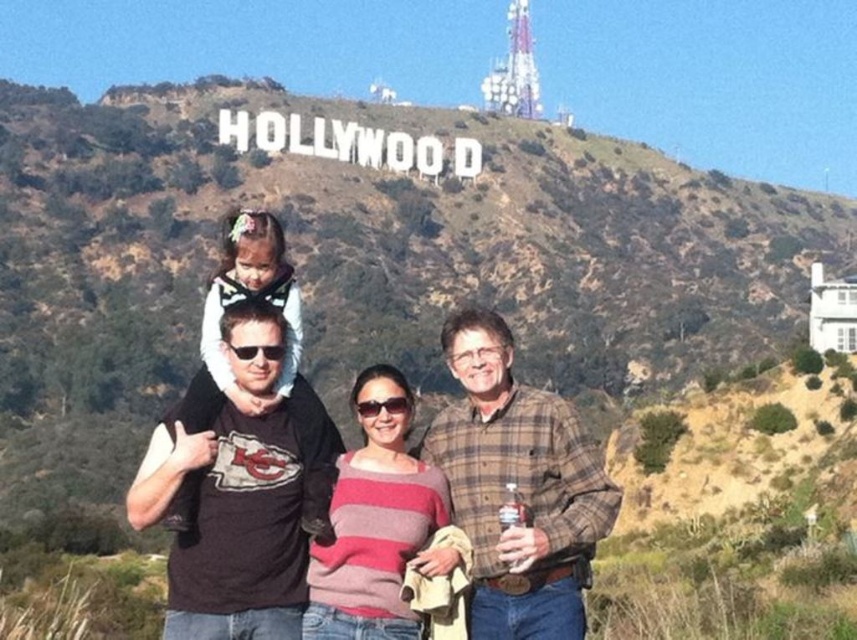
Between point (530, 630) and point (428, 522), which one is positioned in front?

Point (530, 630) is in front.

Who is more forward, (481, 496) or (339, 620)?

Positioned in front is point (339, 620).

Find the location of a particular element. This screenshot has height=640, width=857. plaid flannel shirt at center is located at coordinates (517, 486).

Based on the photo, who is higher up, black cotton shirt at center or pink striped sweater at center?

black cotton shirt at center is higher up.

Which is in front, point (568, 618) or point (378, 513)?

Point (568, 618) is more forward.

Who is more distant from viewer, (x=550, y=403) or (x=393, y=429)?

The point (x=550, y=403) is behind.

Identify the location of black cotton shirt at center. This screenshot has width=857, height=640. (517, 476).

Who is shorter, black cotton t-shirt at center or black cotton shirt at center?

black cotton shirt at center

Does black cotton t-shirt at center appear over black cotton shirt at center?

No, black cotton t-shirt at center is not above black cotton shirt at center.

Is point (249, 365) positioned in front of point (538, 493)?

No, (249, 365) is further to viewer.

This screenshot has width=857, height=640. In order to click on black cotton t-shirt at center in this screenshot , I will do `click(238, 509)`.